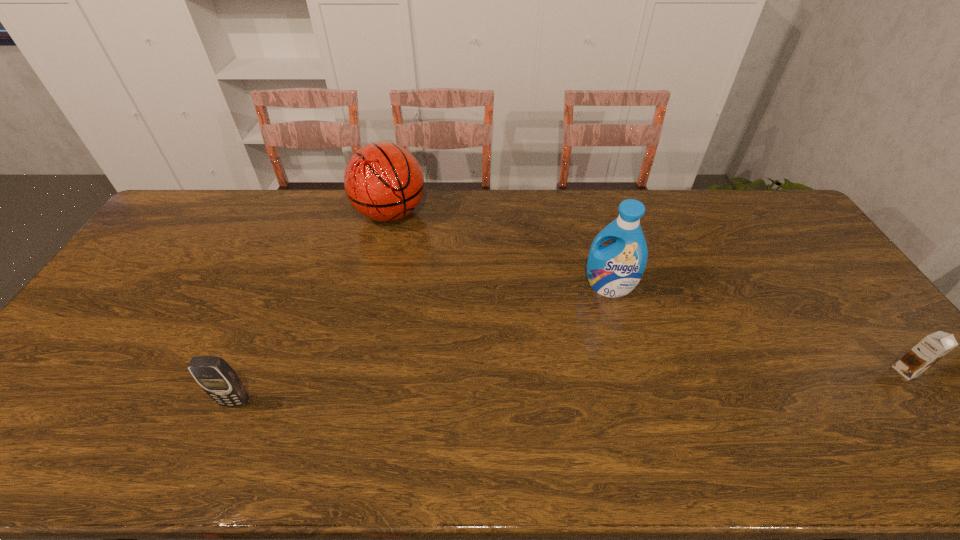
This screenshot has height=540, width=960. In order to click on vacant area between the farthest object and the third nearest object in this screenshot , I will do `click(499, 251)`.

I want to click on unoccupied position between the nearest object and the third object from left to right, so click(422, 345).

Point out which object is positioned as the nearest to the shortest object. Please provide its 2D coordinates. Your answer should be formatted as a tuple, i.e. [(x, y)], where the tuple contains the x and y coordinates of a point satisfying the conditions above.

[(613, 270)]

Point out which object is positioned as the second nearest to the chocolate milk. Please provide its 2D coordinates. Your answer should be formatted as a tuple, i.e. [(x, y)], where the tuple contains the x and y coordinates of a point satisfying the conditions above.

[(383, 181)]

Locate an element on the screen. The image size is (960, 540). free spot that satisfies the following two spatial constraints: 1. on the front side of the rightmost object; 2. on the left side of the second object from left to right is located at coordinates click(x=354, y=371).